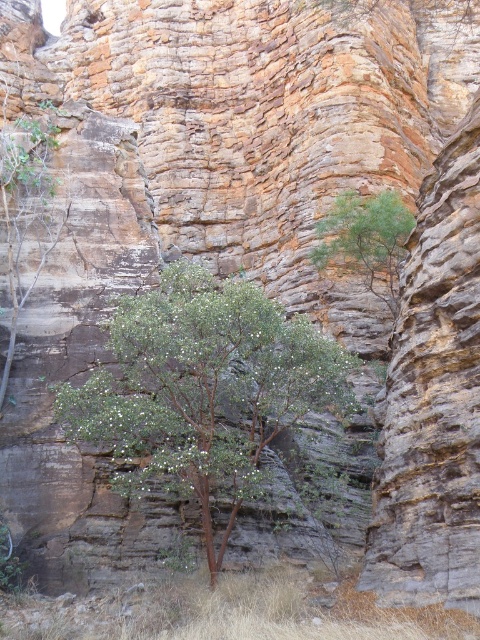
Is green leafy tree at center in front of green leafy shrub at left?

That is True.

Does green leafy tree at center appear on the left side of green leafy shrub at left?

No, green leafy tree at center is not to the left of green leafy shrub at left.

Where is `green leafy tree at center`? The height and width of the screenshot is (640, 480). green leafy tree at center is located at coordinates (203, 388).

At what (x,y) coordinates should I click in order to perform the action: click on green leafy tree at center. Please return your answer as a coordinate pair (x, y). The width and height of the screenshot is (480, 640). Looking at the image, I should click on (203, 388).

Which of these two, green leafy shrub at left or green leafy tree at upper center, stands shorter?

green leafy tree at upper center

Is green leafy shrub at left smaller than green leafy tree at upper center?

No.

Identify the location of green leafy shrub at left. Image resolution: width=480 pixels, height=640 pixels. (27, 205).

The width and height of the screenshot is (480, 640). I want to click on green leafy shrub at left, so click(x=27, y=205).

Is green leafy tree at center to the right of green leafy tree at upper center from the viewer's perspective?

No, green leafy tree at center is not to the right of green leafy tree at upper center.

Is the position of green leafy tree at center more distant than that of green leafy tree at upper center?

No, green leafy tree at center is closer to the viewer.

Is point (315, 360) positioned in front of point (375, 224)?

Yes, it is.

You are a GUI agent. You are given a task and a screenshot of the screen. Output one action in this format:
    pyautogui.click(x=<x>, y=<y>)
    Task: Click on the green leafy tree at center
    Image resolution: width=480 pixels, height=640 pixels.
    Given the screenshot: What is the action you would take?
    pyautogui.click(x=203, y=388)